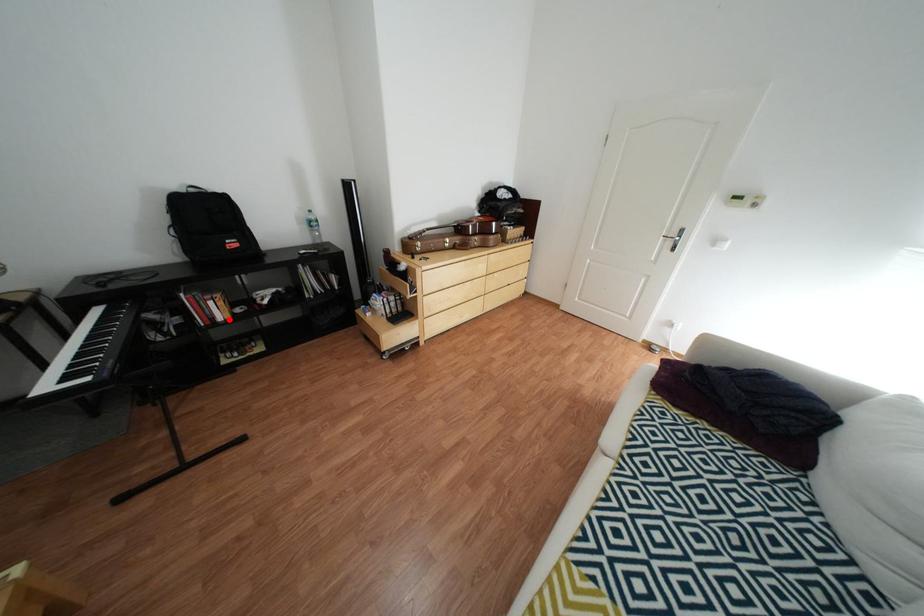
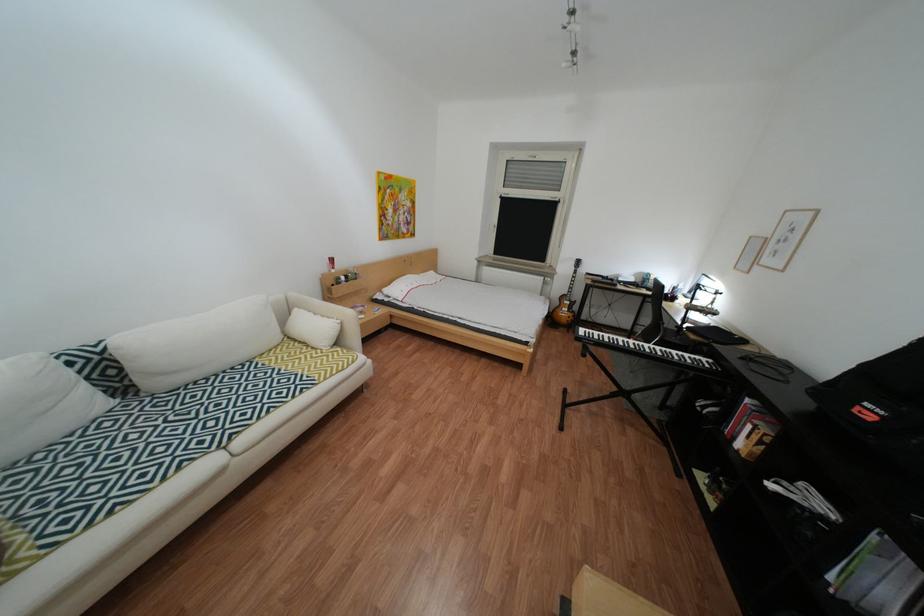
Question: I am providing you with two images of the same scene from different viewpoints. Given a red point in image1, look at the same physical point in image2. Is it:

Choices:
 (A) Closer to the viewpoint
 (B) Farther from the viewpoint

Answer: (B)